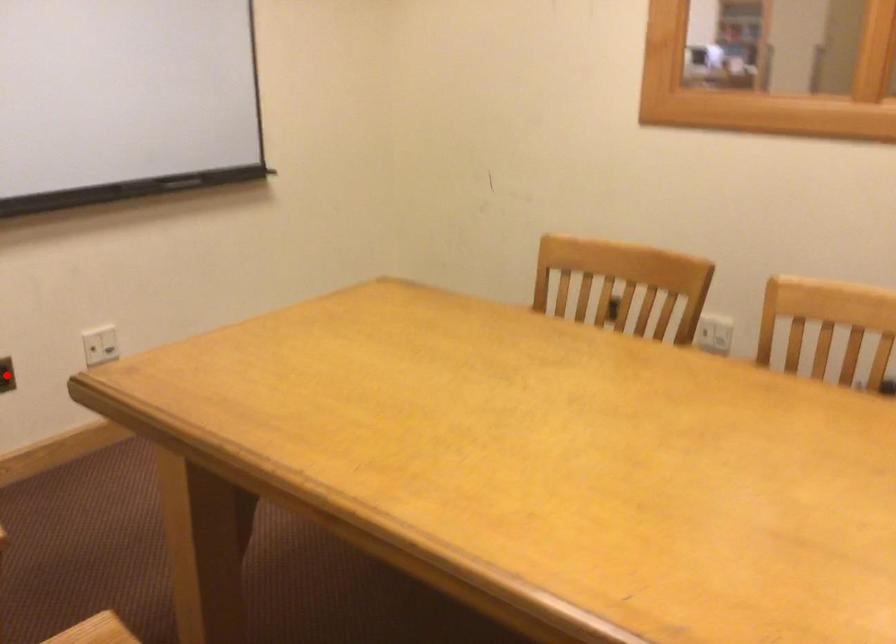
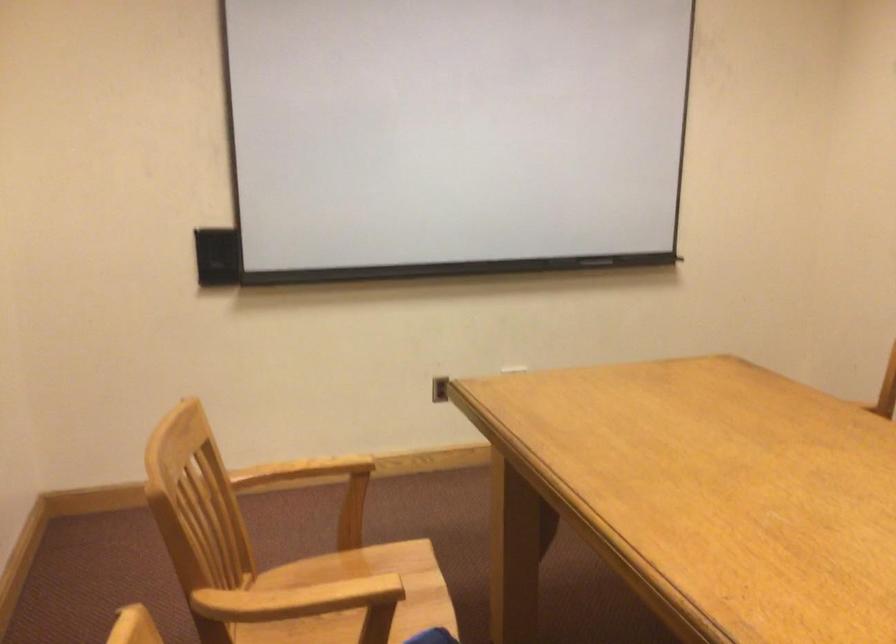
Question: I am providing you with two images of the same scene from different viewpoints. A red point is marked on the first image. At the location where the point appears in image 1, is it still visible in image 2?

Choices:
 (A) Yes
 (B) No

Answer: (B)